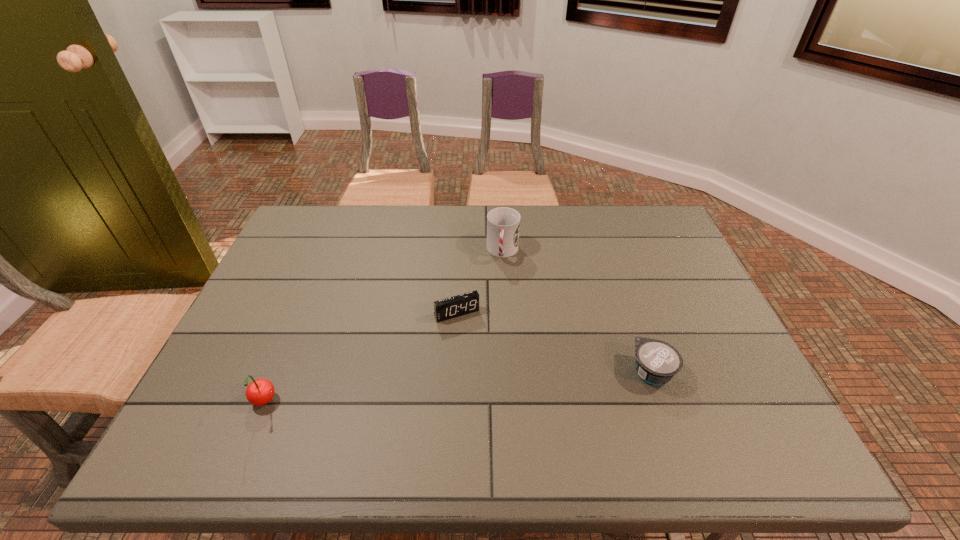
What are the coordinates of `vacant point located between the yogurt and the cherry` in the screenshot? It's located at (458, 387).

This screenshot has width=960, height=540. Identify the location of blank region between the rightmost object and the cup. (577, 312).

Locate an element on the screen. The height and width of the screenshot is (540, 960). vacant space that is in between the second object from left to right and the cherry is located at coordinates (360, 358).

Where is `free area in between the cherry and the second object from left to right`? This screenshot has width=960, height=540. free area in between the cherry and the second object from left to right is located at coordinates (360, 358).

What are the coordinates of `empty space between the cherry and the third object from left to right` in the screenshot? It's located at (383, 327).

This screenshot has width=960, height=540. In order to click on object that is the third closest one to the alarm clock in this screenshot , I will do `click(259, 392)`.

Locate which object is the third closest to the farthest object. Please provide its 2D coordinates. Your answer should be formatted as a tuple, i.e. [(x, y)], where the tuple contains the x and y coordinates of a point satisfying the conditions above.

[(259, 392)]

At what (x,y) coordinates should I click in order to perform the action: click on vacant space that satisfies the following two spatial constraints: 1. on the front side of the yogurt; 2. on the left side of the alarm clock. Please return your answer as a coordinate pair (x, y). The width and height of the screenshot is (960, 540). Looking at the image, I should click on (453, 372).

Find the location of a particular element. The width and height of the screenshot is (960, 540). free location that satisfies the following two spatial constraints: 1. on the front side of the cup; 2. on the right side of the yogurt is located at coordinates (510, 372).

Where is `vacant space that satisfies the following two spatial constraints: 1. on the back side of the cup; 2. on the left side of the leftmost object`? The image size is (960, 540). vacant space that satisfies the following two spatial constraints: 1. on the back side of the cup; 2. on the left side of the leftmost object is located at coordinates (326, 252).